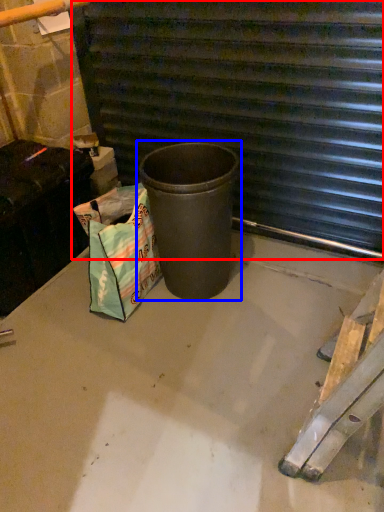
Question: Which object appears farthest to the camera in this image, stairwell (highlighted by a red box) or waste container (highlighted by a blue box)?

Choices:
 (A) stairwell
 (B) waste container

Answer: (B)